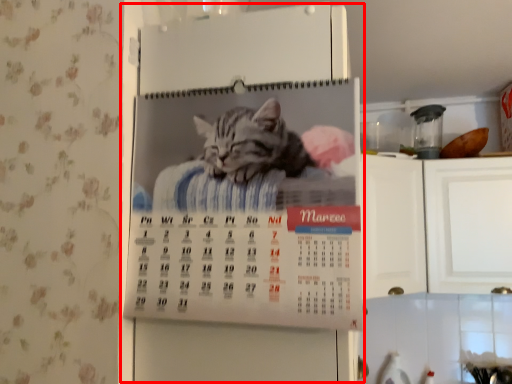
Question: From the image, what is the correct spatial relationship of appliance (annotated by the red box) in relation to appliance?

Choices:
 (A) left
 (B) right

Answer: (A)